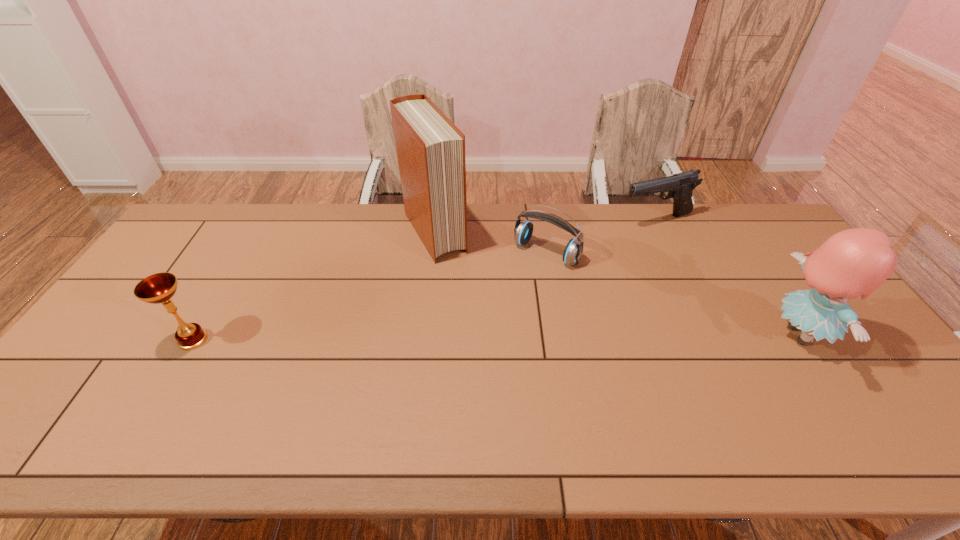
Identify the location of chalice. The image size is (960, 540). (158, 288).

Locate an element on the screen. The image size is (960, 540). the rightmost object is located at coordinates (855, 262).

Locate an element on the screen. The height and width of the screenshot is (540, 960). the fourth shortest object is located at coordinates (855, 262).

Locate an element on the screen. headset is located at coordinates (523, 231).

Where is `gun`? The width and height of the screenshot is (960, 540). gun is located at coordinates (680, 186).

Find the location of a particular element. The image size is (960, 540). the tallest object is located at coordinates (430, 149).

Image resolution: width=960 pixels, height=540 pixels. Identify the location of hardback book. (430, 149).

In order to click on vacant region located 0.160m on the front of the chalice in this screenshot , I will do `click(153, 409)`.

This screenshot has height=540, width=960. In order to click on free space located 0.050m on the front-facing side of the second tallest object in this screenshot , I will do `click(847, 335)`.

Locate an element on the screen. The image size is (960, 540). vacant area located 0.390m on the ear cups of the headset is located at coordinates (459, 353).